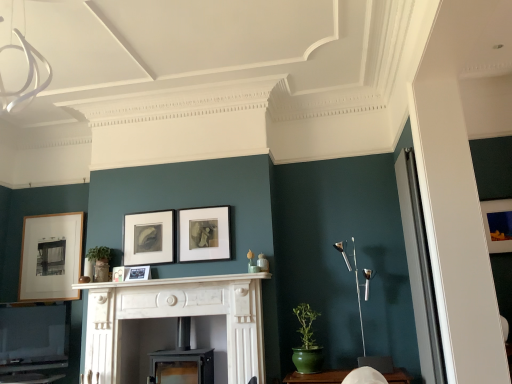
Question: Is matte wooden picture frame at right, the first picture frame when ordered from right to left, bigger or smaller than matte black picture frame at center, the fourth picture frame positioned from the right?

Choices:
 (A) small
 (B) big

Answer: (B)

Question: From the image's perspective, is matte wooden picture frame at right, placed as the 6th picture frame when sorted from left to right, positioned above or below matte black picture frame at center, the fourth picture frame positioned from the right?

Choices:
 (A) above
 (B) below

Answer: (A)

Question: Estimate the real-world distances between objects in this image. Which object is closer to the matte wooden picture frame at right, placed as the 6th picture frame when sorted from left to right?

Choices:
 (A) white marble fireplace at center
 (B) silver metallic floor lamp at right
 (C) matte black picture frame at center, positioned as the fourth picture frame in left-to-right order
 (D) black matte picture frame at center, the fifth picture frame when ordered from left to right
 (E) white marble fireplace at center, the 2th fireplace when ordered from right to left

Answer: (B)

Question: Which object is the farthest from the black matte picture frame at center, placed as the 2th picture frame when sorted from right to left?

Choices:
 (A) green ceramic table at lower center
 (B) wooden picture frame at left, the 6th picture frame from the right
 (C) matte black picture frame at center, positioned as the fourth picture frame in left-to-right order
 (D) matte wooden picture frame at right, the first picture frame when ordered from right to left
 (E) white marble fireplace at center

Answer: (D)